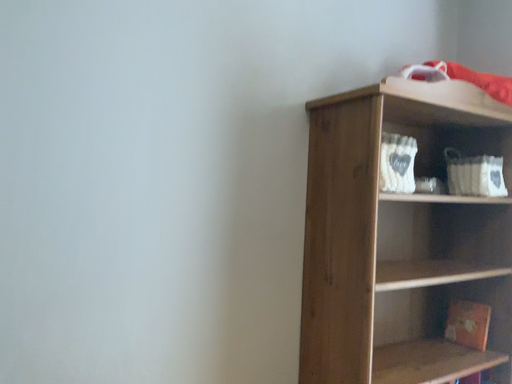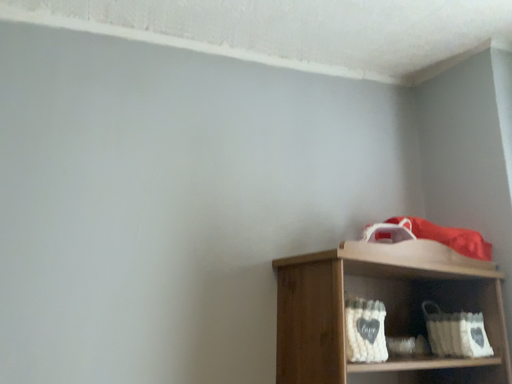
Question: Which way did the camera rotate in the video?

Choices:
 (A) rotated upward
 (B) rotated downward

Answer: (A)